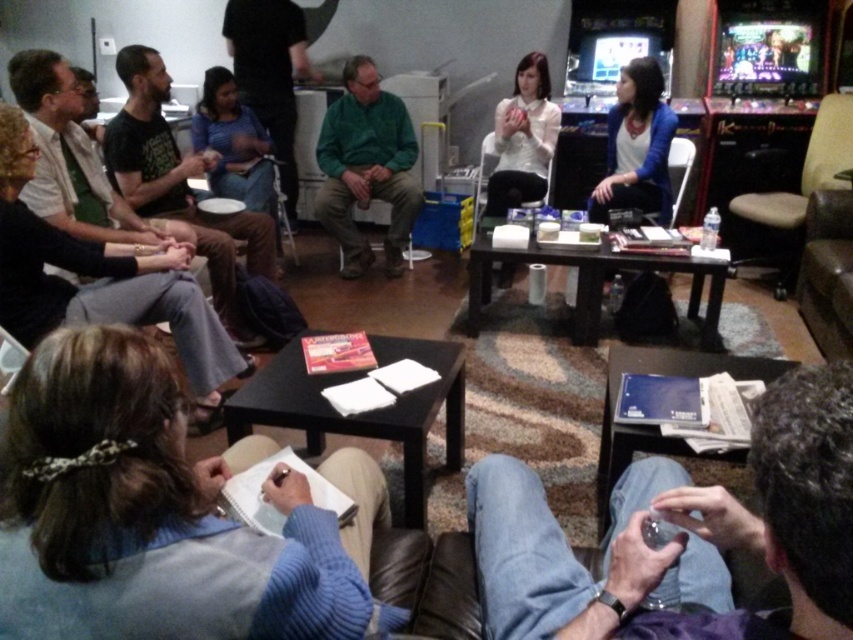
Is dark green shirt at center further to camera compared to dark blue shirt at upper center?

No, dark green shirt at center is closer to the viewer.

Is point (154, 177) farther from viewer compared to point (251, 60)?

No, it is not.

Image resolution: width=853 pixels, height=640 pixels. What do you see at coordinates (180, 186) in the screenshot?
I see `dark green shirt at center` at bounding box center [180, 186].

Where is `dark green shirt at center`? The image size is (853, 640). dark green shirt at center is located at coordinates click(x=180, y=186).

Which is in front, point (125, 292) or point (527, 68)?

Positioned in front is point (125, 292).

Measure the distance between matte black pants at left and white matte shirt at center.

matte black pants at left and white matte shirt at center are 2.04 meters apart.

Does point (112, 272) lie behind point (532, 196)?

No, (112, 272) is in front of (532, 196).

Identify the location of matte black pants at left. (102, 282).

Which is in front, point (351, 256) or point (485, 212)?

Positioned in front is point (485, 212).

Identify the location of green matte jacket at center. Image resolution: width=853 pixels, height=640 pixels. (366, 166).